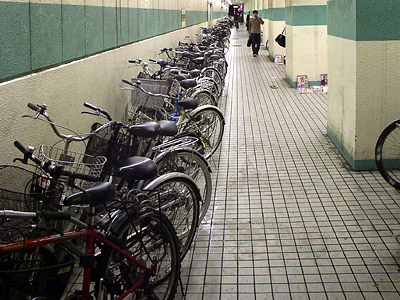
The height and width of the screenshot is (300, 400). What are the coordinates of `wall` in the screenshot? It's located at (71, 43).